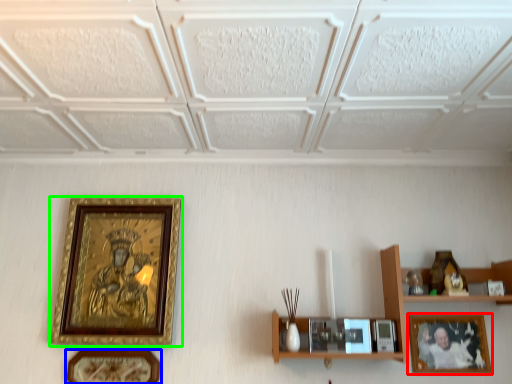
Question: Which is nearer to the picture frame (highlighted by a red box)? picture frame (highlighted by a blue box) or picture frame (highlighted by a green box).

Choices:
 (A) picture frame
 (B) picture frame

Answer: (A)